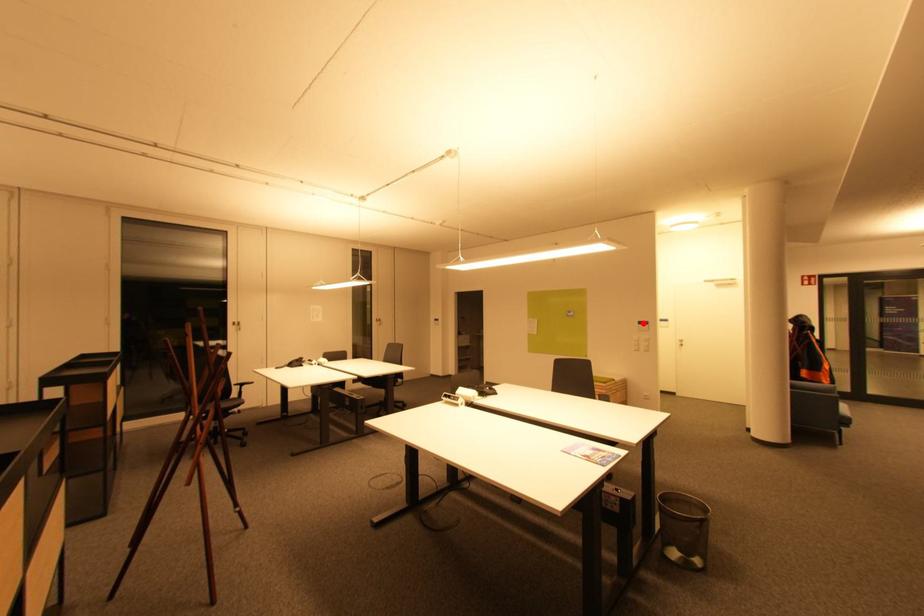
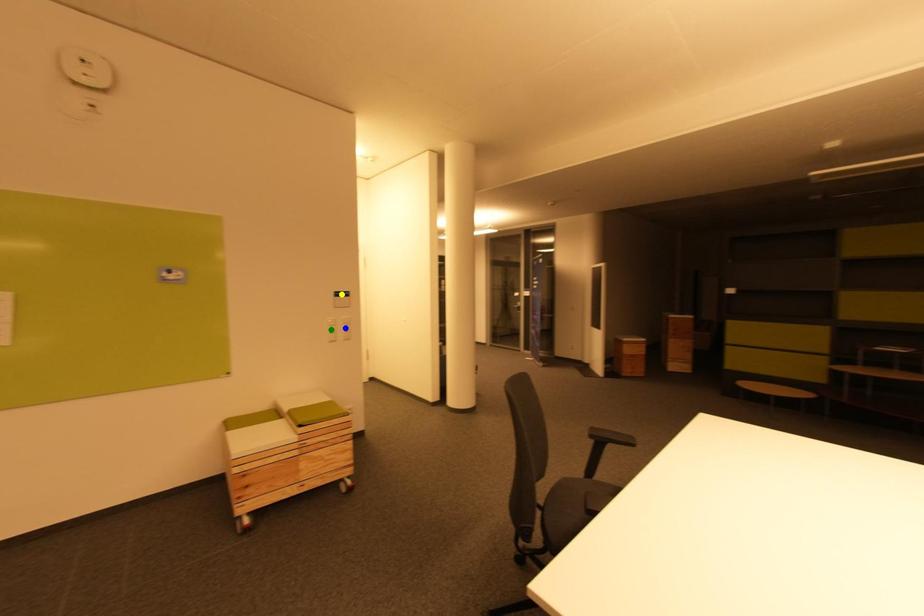
Question: I am providing you with two images of the same scene from different viewpoints. A red point is marked on the first image. You are given multiple points on the second image. Which spot in image 2 lines up with the point in image 1?

Choices:
 (A) blue point
 (B) green point
 (C) yellow point

Answer: (C)